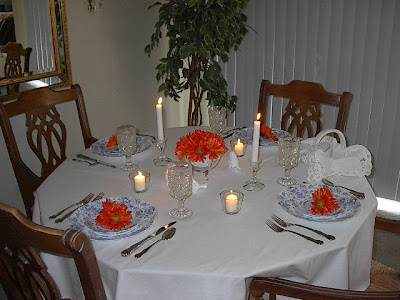
You are a GUI agent. You are given a task and a screenshot of the screen. Output one action in this format:
    pyautogui.click(x=<x>, y=<y>)
    Task: Click on the plates
    This screenshot has height=300, width=400.
    Given the screenshot: What is the action you would take?
    pyautogui.click(x=140, y=215), pyautogui.click(x=141, y=142), pyautogui.click(x=248, y=132), pyautogui.click(x=295, y=200)